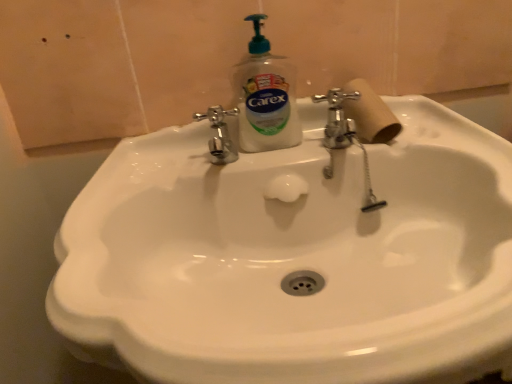
What do you see at coordinates (265, 97) in the screenshot?
I see `clear plastic soap dispenser at center` at bounding box center [265, 97].

In order to face clear plastic soap dispenser at center, should I rotate leftwards or rightwards?

To face it directly, rotate right by 1.023 degrees.

Image resolution: width=512 pixels, height=384 pixels. I want to click on white glossy sink at center, so click(294, 258).

The height and width of the screenshot is (384, 512). What are the coordinates of `wooden at right` in the screenshot? It's located at (370, 114).

Where is `clear plastic soap dispenser at center`? clear plastic soap dispenser at center is located at coordinates (265, 97).

At what (x,y) coordinates should I click in order to perform the action: click on toilet paper behind the clear plastic soap dispenser at center. Please return your answer as a coordinate pair (x, y). Looking at the image, I should click on (370, 114).

Is wooden at right in contact with clear plastic soap dispenser at center?

No, wooden at right is not beside clear plastic soap dispenser at center.

Looking at this image, how distant is wooden at right from clear plastic soap dispenser at center?

They are 4.84 inches apart.

From the image's perspective, which one is positioned higher, white glossy sink at center or clear plastic soap dispenser at center?

clear plastic soap dispenser at center appears higher in the image.

Locate an element on the screen. The image size is (512, 384). soap dispenser behind the white glossy sink at center is located at coordinates (265, 97).

Is the depth of wooden at right less than that of white glossy sink at center?

That is False.

Is wooden at right taller than white glossy sink at center?

Incorrect, the height of wooden at right is not larger of that of white glossy sink at center.

From a real-world perspective, does wooden at right sit lower than white glossy sink at center?

Actually, wooden at right is physically above white glossy sink at center in the real world.

From the image's perspective, which one is positioned lower, clear plastic soap dispenser at center or wooden at right?

wooden at right.

Which of these two, clear plastic soap dispenser at center or wooden at right, stands taller?

clear plastic soap dispenser at center.

Which of these two, clear plastic soap dispenser at center or wooden at right, is thinner?

With smaller width is clear plastic soap dispenser at center.

Does clear plastic soap dispenser at center lie in front of wooden at right?

Yes, clear plastic soap dispenser at center is closer to the camera.

Is point (263, 130) positioned in front of point (415, 289)?

No, (263, 130) is behind (415, 289).

In the image, is clear plastic soap dispenser at center positioned in front of or behind white glossy sink at center?

Visually, clear plastic soap dispenser at center is located behind white glossy sink at center.

From a real-world perspective, is clear plastic soap dispenser at center on top of white glossy sink at center?

Correct, in the physical world, clear plastic soap dispenser at center is higher than white glossy sink at center.

Is clear plastic soap dispenser at center inside or outside of white glossy sink at center?

clear plastic soap dispenser at center cannot be found inside white glossy sink at center.

From the image's perspective, is white glossy sink at center above wooden at right?

No, from the image's perspective, white glossy sink at center is not above wooden at right.

From the picture: Is white glossy sink at center bigger than wooden at right?

Indeed, white glossy sink at center has a larger size compared to wooden at right.

From a real-world perspective, is white glossy sink at center positioned above or below wooden at right?

white glossy sink at center is situated lower than wooden at right in the real world.

Identify the location of toilet paper below the clear plastic soap dispenser at center (from the image's perspective). This screenshot has width=512, height=384. (370, 114).

Locate an element on the screen. soap dispenser located behind the white glossy sink at center is located at coordinates (265, 97).

From the image, which object appears to be nearer to white glossy sink at center, clear plastic soap dispenser at center or wooden at right?

clear plastic soap dispenser at center lies closer to white glossy sink at center than the other object.

Based on their spatial positions, is white glossy sink at center or clear plastic soap dispenser at center further from wooden at right?

white glossy sink at center is further to wooden at right.

Which object lies nearer to the anchor point clear plastic soap dispenser at center, wooden at right or white glossy sink at center?

wooden at right is positioned closer to the anchor clear plastic soap dispenser at center.

Looking at the image, which one is located further to clear plastic soap dispenser at center, white glossy sink at center or wooden at right?

The object further to clear plastic soap dispenser at center is white glossy sink at center.

Looking at the image, which one is located further to white glossy sink at center, wooden at right or clear plastic soap dispenser at center?

wooden at right is further to white glossy sink at center.

Which object lies further to the anchor point wooden at right, clear plastic soap dispenser at center or white glossy sink at center?

Based on the image, white glossy sink at center appears to be further to wooden at right.

You are a GUI agent. You are given a task and a screenshot of the screen. Output one action in this format:
    pyautogui.click(x=<x>, y=<y>)
    Task: Click on the toilet paper between clear plastic soap dispenser at center and white glossy sink at center in the up-down direction
    The width and height of the screenshot is (512, 384).
    Given the screenshot: What is the action you would take?
    pyautogui.click(x=370, y=114)